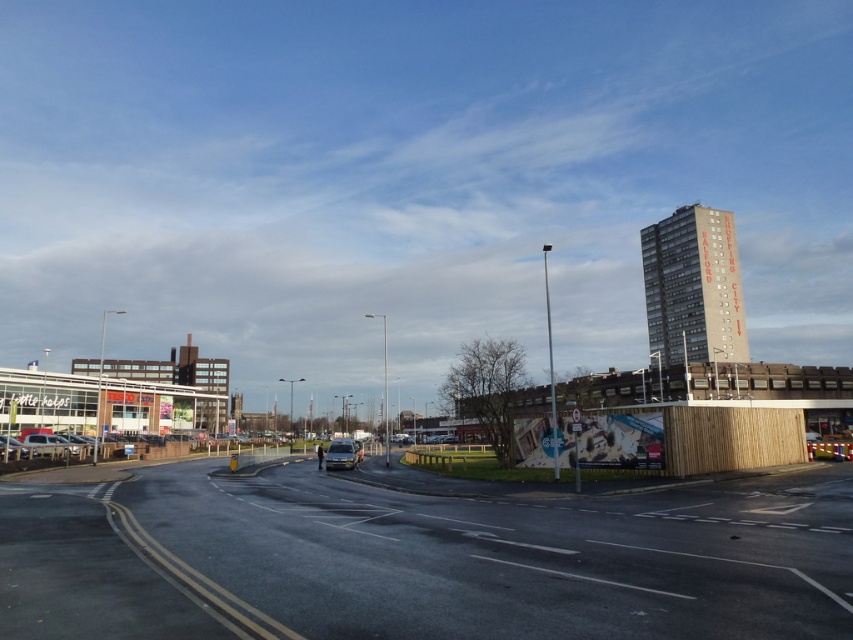
You are a delivery driver who needs to park your vehicle in a space that can accommodate your vehicle height. You have a silver metallic van at center and a matte silver car at lower left in the parking area. Which vehicle requires a taller parking space?

The silver metallic van at center requires a taller parking space because it is taller than the matte silver car at lower left.

You are a pedestrian standing at the crosswalk near the Tesco supermarket. You need to cross the road to reach the residential building with the chimney. Which vehicle, the silver metallic van at center or the metallic silver car at lower left, is closer to your path?

The metallic silver car at lower left is closer to your path because it is positioned to the left of the silver metallic van at center, which is further away from the crosswalk near Tesco supermarket.

You are driving a delivery truck and need to park in the parking lot near the Tesco supermarket. Your truck is 20 meters long. There is a silver metallic van at center and a matte silver car at lower left parked in the parking lot. Can your truck fit between them without touching either vehicle?

The silver metallic van at center is 20.33 meters from the matte silver car at lower left. Since your truck is 20 meters long, it can fit between them as the distance between the two vehicles is slightly larger than the truck.